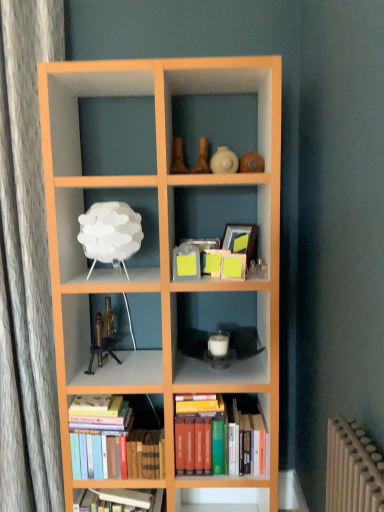
Question: Is the position of brass metallic microscope at center-left less distant than that of hardcover books at center, arranged as the 1th book when viewed from the right?

Choices:
 (A) yes
 (B) no

Answer: (B)

Question: From a real-world perspective, does brass metallic microscope at center-left sit lower than hardcover books at center, the 2th book from the left?

Choices:
 (A) no
 (B) yes

Answer: (A)

Question: Can you confirm if brass metallic microscope at center-left is thinner than hardcover books at center, arranged as the 1th book when viewed from the right?

Choices:
 (A) no
 (B) yes

Answer: (B)

Question: Are brass metallic microscope at center-left and hardcover books at center, arranged as the 1th book when viewed from the right, far apart?

Choices:
 (A) yes
 (B) no

Answer: (B)

Question: Is brass metallic microscope at center-left smaller than hardcover books at center, the 2th book from the left?

Choices:
 (A) no
 (B) yes

Answer: (B)

Question: Is point (218, 435) positioned closer to the camera than point (110, 315)?

Choices:
 (A) farther
 (B) closer

Answer: (B)

Question: From the image's perspective, is hardcover books at center, arranged as the 1th book when viewed from the right, located above or below brass metallic microscope at center-left?

Choices:
 (A) below
 (B) above

Answer: (A)

Question: In terms of width, does hardcover books at center, arranged as the 1th book when viewed from the right, look wider or thinner when compared to brass metallic microscope at center-left?

Choices:
 (A) wide
 (B) thin

Answer: (A)

Question: Would you say hardcover books at center, arranged as the 1th book when viewed from the right, is to the left or to the right of brass metallic microscope at center-left in the picture?

Choices:
 (A) left
 (B) right

Answer: (B)

Question: Looking at the image, does brass metallic microscope at center-left seem bigger or smaller compared to white matte lamp at upper left, the second shelf from the bottom?

Choices:
 (A) small
 (B) big

Answer: (A)

Question: Considering the positions of point (109, 308) and point (59, 189), is point (109, 308) closer or farther from the camera than point (59, 189)?

Choices:
 (A) farther
 (B) closer

Answer: (A)

Question: Considering the positions of brass metallic microscope at center-left and white matte lamp at upper left, arranged as the 1th shelf when viewed from the top, in the image, is brass metallic microscope at center-left taller or shorter than white matte lamp at upper left, arranged as the 1th shelf when viewed from the top,?

Choices:
 (A) tall
 (B) short

Answer: (B)

Question: From the image's perspective, relative to white matte lamp at upper left, arranged as the 1th shelf when viewed from the top, is brass metallic microscope at center-left above or below?

Choices:
 (A) below
 (B) above

Answer: (A)

Question: Considering their positions, is white matte lamp at upper left, the 2th shelf positioned from the right, located in front of or behind hardcover books at bottom left, the first book positioned from the left?

Choices:
 (A) front
 (B) behind

Answer: (A)

Question: Is white matte lamp at upper left, acting as the 1th shelf starting from the left, bigger or smaller than hardcover books at bottom left, the first book positioned from the left?

Choices:
 (A) small
 (B) big

Answer: (A)